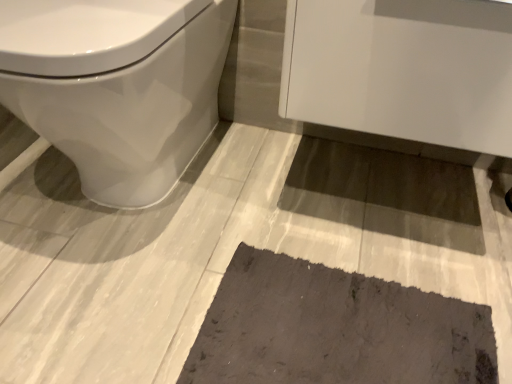
Where is `vacant space underneath white glossy toilet at left (from a real-world perspective)`? The width and height of the screenshot is (512, 384). vacant space underneath white glossy toilet at left (from a real-world perspective) is located at coordinates (123, 208).